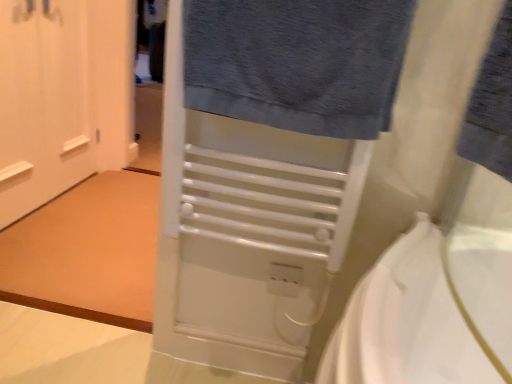
Locate an element on the screen. This screenshot has width=512, height=384. white plastic electric outlet at center is located at coordinates (285, 279).

Image resolution: width=512 pixels, height=384 pixels. What are the coordinates of `dark gray textured towel at upper center` in the screenshot? It's located at (297, 62).

What do you see at coordinates (297, 62) in the screenshot? Image resolution: width=512 pixels, height=384 pixels. I see `dark gray textured towel at upper center` at bounding box center [297, 62].

Where is `blue cotton towel at upper right`? The width and height of the screenshot is (512, 384). blue cotton towel at upper right is located at coordinates (492, 105).

Between white plastic electric outlet at center and dark gray textured towel at upper center, which one has larger width?

dark gray textured towel at upper center.

Looking at this image, from a real-world perspective, which is physically above, white plastic electric outlet at center or dark gray textured towel at upper center?

dark gray textured towel at upper center.

Can you see white plastic electric outlet at center touching dark gray textured towel at upper center?

No.

Would you say white plastic electric outlet at center is to the left or to the right of dark gray textured towel at upper center in the picture?

white plastic electric outlet at center is positioned on dark gray textured towel at upper center's right side.

Can we say white plastic electric outlet at center lies outside white matte door at left?

white plastic electric outlet at center is positioned outside white matte door at left.

Considering the relative sizes of white plastic electric outlet at center and white matte door at left in the image provided, is white plastic electric outlet at center smaller than white matte door at left?

Indeed, white plastic electric outlet at center has a smaller size compared to white matte door at left.

From a real-world perspective, does white plastic electric outlet at center sit lower than white matte door at left?

Indeed, from a real-world perspective, white plastic electric outlet at center is positioned beneath white matte door at left.

Does blue cotton towel at upper right come behind white plastic electric outlet at center?

That is False.

Considering the positions of point (506, 164) and point (297, 283), is point (506, 164) closer or farther from the camera than point (297, 283)?

Point (506, 164).

In terms of height, does blue cotton towel at upper right look taller or shorter compared to white plastic electric outlet at center?

blue cotton towel at upper right is taller than white plastic electric outlet at center.

Between blue cotton towel at upper right and white plastic electric outlet at center, which one has larger size?

With larger size is blue cotton towel at upper right.

Between white matte door at left and blue cotton towel at upper right, which one has less height?

blue cotton towel at upper right.

Is white matte door at left closer to the viewer compared to blue cotton towel at upper right?

No, the depth of white matte door at left is greater than that of blue cotton towel at upper right.

Could you tell me if white matte door at left is turned towards blue cotton towel at upper right?

No, white matte door at left is not facing towards blue cotton towel at upper right.

Does white matte door at left have a lesser width compared to blue cotton towel at upper right?

Yes, white matte door at left is thinner than blue cotton towel at upper right.

Can you confirm if dark gray textured towel at upper center is smaller than white plastic electric outlet at center?

Actually, dark gray textured towel at upper center might be larger than white plastic electric outlet at center.

Visually, is dark gray textured towel at upper center positioned to the left or to the right of white plastic electric outlet at center?

In the image, dark gray textured towel at upper center appears on the left side of white plastic electric outlet at center.

How different are the orientations of dark gray textured towel at upper center and white plastic electric outlet at center in degrees?

dark gray textured towel at upper center and white plastic electric outlet at center are facing 1.07 degrees away from each other.

Between white plastic electric outlet at center and blue cotton towel at upper right, which one is positioned in front?

blue cotton towel at upper right is closer to the camera.

Looking at the image, does white plastic electric outlet at center seem bigger or smaller compared to blue cotton towel at upper right?

In the image, white plastic electric outlet at center appears to be smaller than blue cotton towel at upper right.

Can you confirm if white plastic electric outlet at center is shorter than blue cotton towel at upper right?

Yes.

From the image's perspective, is white plastic electric outlet at center above or below blue cotton towel at upper right?

white plastic electric outlet at center is situated lower than blue cotton towel at upper right in the image.

Is white matte door at left taller or shorter than white plastic electric outlet at center?

Considering their sizes, white matte door at left has more height than white plastic electric outlet at center.

Does white matte door at left touch white plastic electric outlet at center?

No, white matte door at left is not next to white plastic electric outlet at center.

Measure the distance between white matte door at left and white plastic electric outlet at center.

white matte door at left and white plastic electric outlet at center are 1.51 meters apart from each other.

Is white matte door at left oriented away from white plastic electric outlet at center?

No, white matte door at left is not facing the opposite direction of white plastic electric outlet at center.

Locate an element on the screen. towel lying on the left of white plastic electric outlet at center is located at coordinates (297, 62).

You are a GUI agent. You are given a task and a screenshot of the screen. Output one action in this format:
    pyautogui.click(x=<x>, y=<y>)
    Task: Click on the door above the white plastic electric outlet at center (from the image's perspective)
    
    Given the screenshot: What is the action you would take?
    [x=63, y=97]

When comparing their distances from dark gray textured towel at upper center, does white matte door at left or blue cotton towel at upper right seem further?

white matte door at left.

Looking at the image, which one is located further to blue cotton towel at upper right, white plastic electric outlet at center or white matte door at left?

white matte door at left.

Based on their spatial positions, is dark gray textured towel at upper center or white matte door at left further from white plastic electric outlet at center?

The object further to white plastic electric outlet at center is white matte door at left.

When comparing their distances from white plastic electric outlet at center, does blue cotton towel at upper right or white matte door at left seem closer?

blue cotton towel at upper right is closer to white plastic electric outlet at center.

Based on their spatial positions, is white matte door at left or dark gray textured towel at upper center closer to white plastic electric outlet at center?

Based on the image, dark gray textured towel at upper center appears to be nearer to white plastic electric outlet at center.

When comparing their distances from dark gray textured towel at upper center, does white plastic electric outlet at center or blue cotton towel at upper right seem closer?

blue cotton towel at upper right is closer to dark gray textured towel at upper center.

Which object lies nearer to the anchor point blue cotton towel at upper right, white matte door at left or white plastic electric outlet at center?

The object closer to blue cotton towel at upper right is white plastic electric outlet at center.

From the image, which object appears to be nearer to white matte door at left, white plastic electric outlet at center or dark gray textured towel at upper center?

dark gray textured towel at upper center lies closer to white matte door at left than the other object.

Image resolution: width=512 pixels, height=384 pixels. I want to click on towel between blue cotton towel at upper right and white plastic electric outlet at center from front to back, so click(297, 62).

What are the coordinates of `electric outlet situated between white matte door at left and blue cotton towel at upper right from left to right` in the screenshot? It's located at (285, 279).

Image resolution: width=512 pixels, height=384 pixels. I want to click on towel situated between white matte door at left and blue cotton towel at upper right from left to right, so click(x=297, y=62).

Locate an element on the screen. Image resolution: width=512 pixels, height=384 pixels. towel located between white matte door at left and white plastic electric outlet at center in the left-right direction is located at coordinates (297, 62).